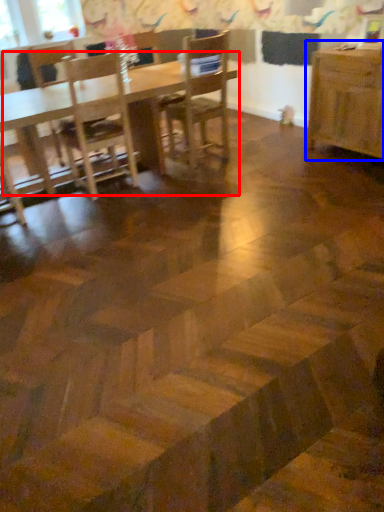
Question: Which object is closer to the camera taking this photo, table (highlighted by a red box) or table (highlighted by a blue box)?

Choices:
 (A) table
 (B) table

Answer: (A)